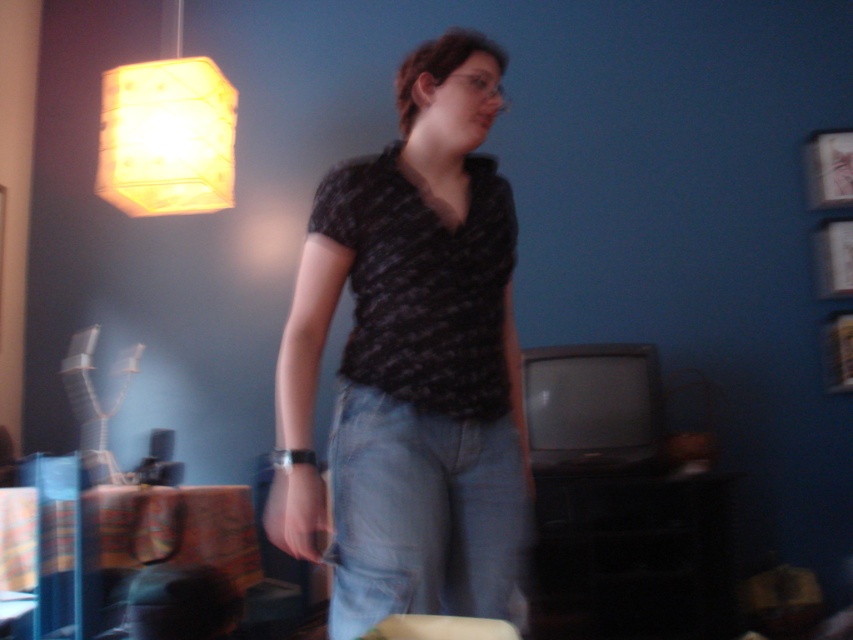
Question: Does matte black shirt at center have a greater width compared to yellow paper lampshade at upper left?

Choices:
 (A) no
 (B) yes

Answer: (B)

Question: Which point is farther to the camera?

Choices:
 (A) click(x=146, y=144)
 (B) click(x=434, y=237)

Answer: (A)

Question: Can you confirm if matte black shirt at center is positioned to the right of yellow paper lampshade at upper left?

Choices:
 (A) yes
 (B) no

Answer: (A)

Question: Which of the following is the farthest from the observer?

Choices:
 (A) (184, 179)
 (B) (366, 493)

Answer: (A)

Question: Is matte black shirt at center positioned before yellow paper lampshade at upper left?

Choices:
 (A) no
 (B) yes

Answer: (B)

Question: Which point appears closest to the camera in this image?

Choices:
 (A) (212, 90)
 (B) (485, 465)

Answer: (B)